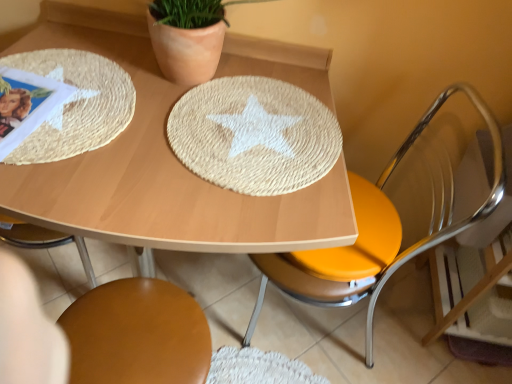
Question: Considering their positions, is metallic yellow seat at right, acting as the second chair starting from the left, located in front of or behind brown leather chair at lower center, acting as the first chair starting from the left?

Choices:
 (A) front
 (B) behind

Answer: (A)

Question: Would you say metallic yellow seat at right, which ranks as the first chair in right-to-left order, is inside or outside brown leather chair at lower center, positioned as the second chair in right-to-left order?

Choices:
 (A) inside
 (B) outside

Answer: (B)

Question: Which object is positioned farthest from the natural fiber placemat at center?

Choices:
 (A) woven straw placemat at center
 (B) metallic yellow seat at right, acting as the second chair starting from the left
 (C) raffia textured placemat at upper left
 (D) brown leather chair at lower center, acting as the first chair starting from the left

Answer: (B)

Question: Which object is the closest to the natural fiber placemat at center?

Choices:
 (A) metallic yellow seat at right, acting as the second chair starting from the left
 (B) brown leather chair at lower center, positioned as the second chair in right-to-left order
 (C) raffia textured placemat at upper left
 (D) woven straw placemat at center

Answer: (D)